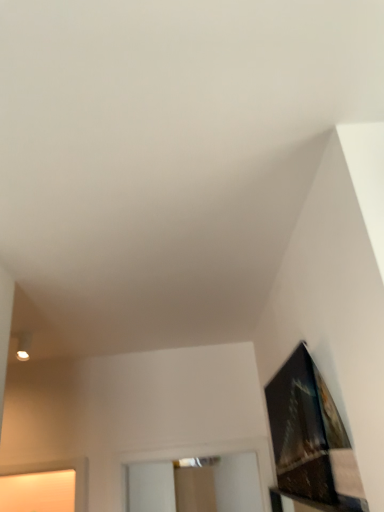
The image size is (384, 512). What do you see at coordinates (311, 438) in the screenshot?
I see `matte black picture frame at upper right` at bounding box center [311, 438].

In order to face matte black picture frame at upper right, should I rotate leftwards or rightwards?

Rotate right and turn 12.853 degrees.

This screenshot has width=384, height=512. Identify the location of matte black picture frame at upper right. (311, 438).

Where is `matte black picture frame at upper right`? matte black picture frame at upper right is located at coordinates (311, 438).